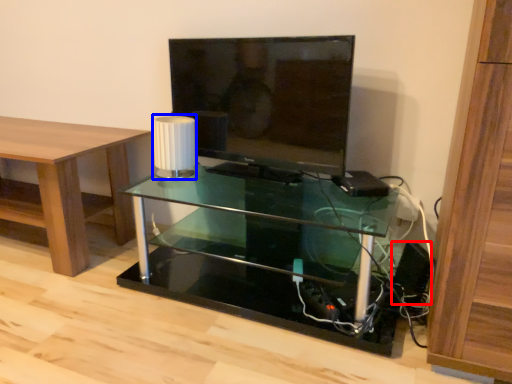
Question: Among these objects, which one is farthest to the camera, speaker (highlighted by a red box) or lamp (highlighted by a blue box)?

Choices:
 (A) speaker
 (B) lamp

Answer: (B)